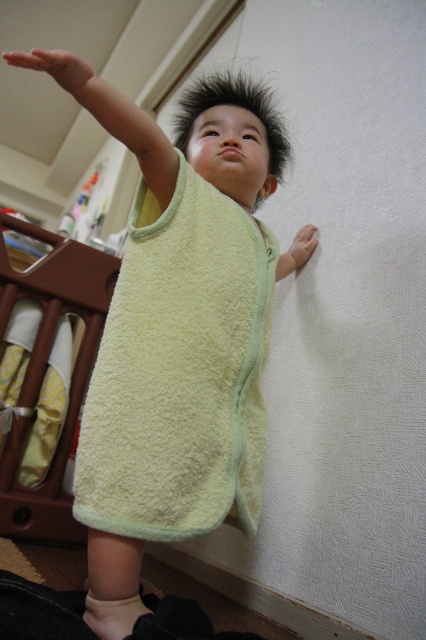
Question: Among these objects, which one is farthest from the camera?

Choices:
 (A) matte yellow towel at center
 (B) soft yellow towel at center
 (C) brown wood/texture infant bed at lower left
 (D) soft green towel at upper center

Answer: (A)

Question: Is soft green towel at upper center closer to the viewer compared to brown wood/texture infant bed at lower left?

Choices:
 (A) yes
 (B) no

Answer: (A)

Question: Among these points, which one is nearest to the camera?

Choices:
 (A) (74, 68)
 (B) (28, 355)
 (C) (238, 321)

Answer: (A)

Question: Which of these objects is positioned closest to the yellow soft towel at lower left?

Choices:
 (A) yellow towel at upper left
 (B) brown wood/texture infant bed at lower left
 (C) matte yellow towel at center
 (D) soft green towel at upper center

Answer: (B)

Question: Does soft yellow towel at center appear on the right side of matte yellow towel at upper left?

Choices:
 (A) yes
 (B) no

Answer: (A)

Question: Can you confirm if soft yellow towel at center is positioned to the right of matte yellow towel at center?

Choices:
 (A) yes
 (B) no

Answer: (B)